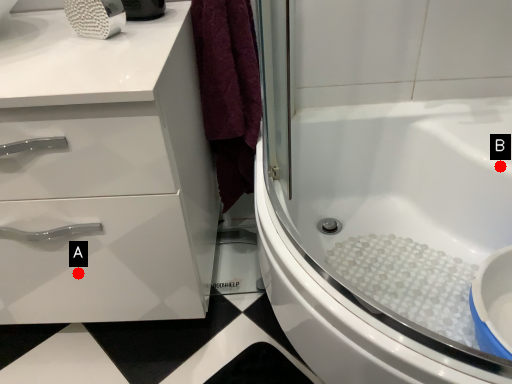
Question: Two points are circled on the image, labeled by A and B beside each circle. Which point appears closest to the camera in this image?

Choices:
 (A) A is closer
 (B) B is closer

Answer: (A)